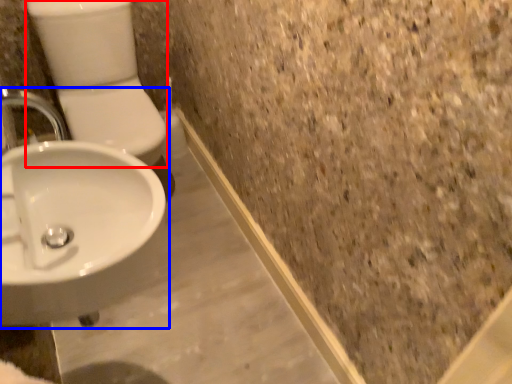
Question: Among these objects, which one is farthest to the camera, toilet bowl (highlighted by a red box) or sink (highlighted by a blue box)?

Choices:
 (A) toilet bowl
 (B) sink

Answer: (A)